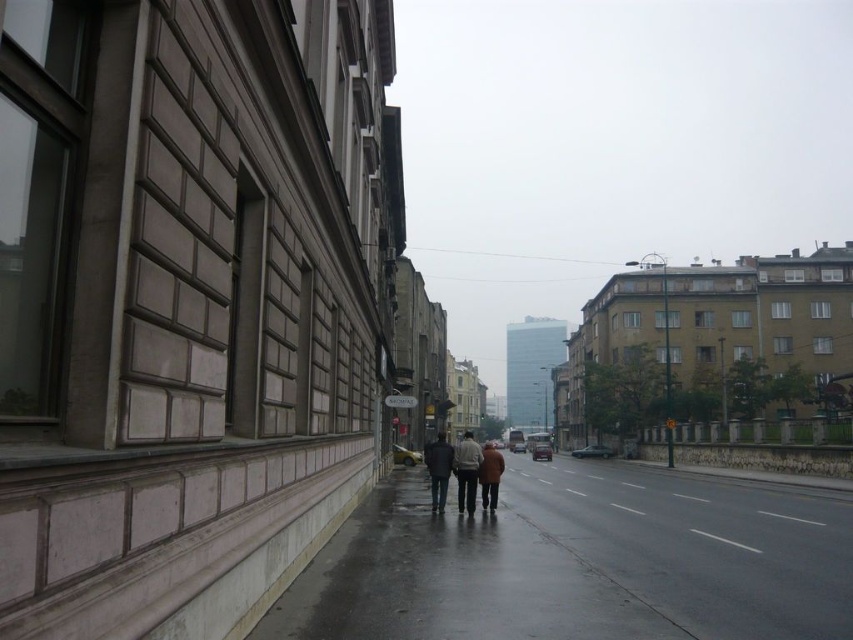
Question: Considering the relative positions of concrete sidewalk at lower center and light brown leather jacket at center in the image provided, where is concrete sidewalk at lower center located with respect to light brown leather jacket at center?

Choices:
 (A) right
 (B) left

Answer: (A)

Question: From the image, what is the correct spatial relationship of concrete sidewalk at lower center in relation to light brown leather jacket at center?

Choices:
 (A) below
 (B) above

Answer: (B)

Question: Among these objects, which one is nearest to the camera?

Choices:
 (A) concrete sidewalk at lower center
 (B) light brown leather jacket at center
 (C) dark brown leather jacket at center
 (D) dark gray coat at center

Answer: (A)

Question: Does light brown leather jacket at center have a lesser width compared to brown wool coat at center?

Choices:
 (A) no
 (B) yes

Answer: (B)

Question: Estimate the real-world distances between objects in this image. Which object is closer to the dark gray coat at center?

Choices:
 (A) concrete sidewalk at lower center
 (B) brown wool coat at center
 (C) dark brown leather jacket at center
 (D) light brown leather jacket at center

Answer: (C)

Question: Which point is farther from the camera taking this photo?

Choices:
 (A) click(433, 497)
 (B) click(492, 515)

Answer: (A)